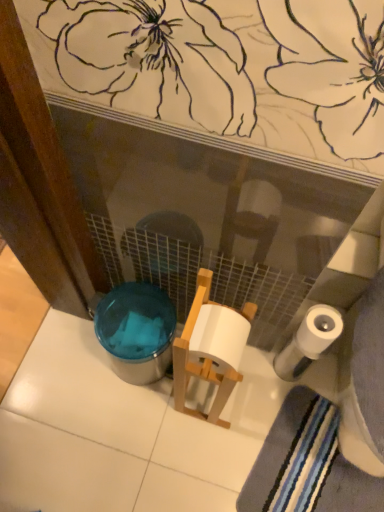
Question: Considering the relative positions of translucent plastic potty at lower left and striped cotton bath towel at lower right in the image provided, is translucent plastic potty at lower left to the right of striped cotton bath towel at lower right from the viewer's perspective?

Choices:
 (A) no
 (B) yes

Answer: (A)

Question: From the image's perspective, is translucent plastic potty at lower left under striped cotton bath towel at lower right?

Choices:
 (A) yes
 (B) no

Answer: (B)

Question: From a real-world perspective, is translucent plastic potty at lower left over striped cotton bath towel at lower right?

Choices:
 (A) yes
 (B) no

Answer: (A)

Question: Is striped cotton bath towel at lower right completely or partially inside translucent plastic potty at lower left?

Choices:
 (A) yes
 (B) no

Answer: (B)

Question: Is translucent plastic potty at lower left shorter than striped cotton bath towel at lower right?

Choices:
 (A) no
 (B) yes

Answer: (A)

Question: Is there a large distance between translucent plastic potty at lower left and striped cotton bath towel at lower right?

Choices:
 (A) yes
 (B) no

Answer: (B)

Question: Is white matte toilet paper at lower right positioned with its back to translucent plastic potty at lower left?

Choices:
 (A) no
 (B) yes

Answer: (A)

Question: From the image's perspective, is white matte toilet paper at lower right over translucent plastic potty at lower left?

Choices:
 (A) no
 (B) yes

Answer: (B)

Question: Is white matte toilet paper at lower right facing towards translucent plastic potty at lower left?

Choices:
 (A) no
 (B) yes

Answer: (A)

Question: Could translucent plastic potty at lower left be considered to be inside white matte toilet paper at lower right?

Choices:
 (A) no
 (B) yes

Answer: (A)

Question: Is white matte toilet paper at lower right closer to the viewer compared to translucent plastic potty at lower left?

Choices:
 (A) no
 (B) yes

Answer: (B)

Question: Does white matte toilet paper at lower right have a greater width compared to translucent plastic potty at lower left?

Choices:
 (A) yes
 (B) no

Answer: (B)

Question: Can you confirm if striped cotton bath towel at lower right is positioned to the left of translucent plastic potty at lower left?

Choices:
 (A) no
 (B) yes

Answer: (A)